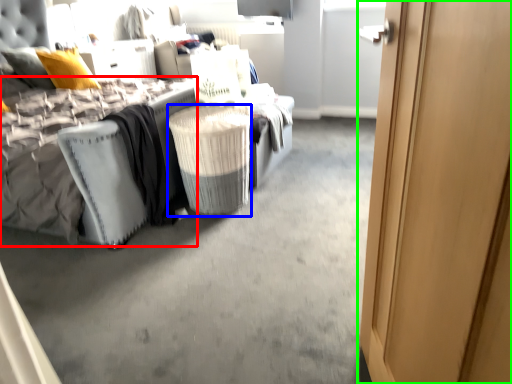
Question: Which object is the farthest from mattress (highlighted by a red box)? Choose among these: laundry basket (highlighted by a blue box) or door (highlighted by a green box).

Choices:
 (A) laundry basket
 (B) door

Answer: (B)